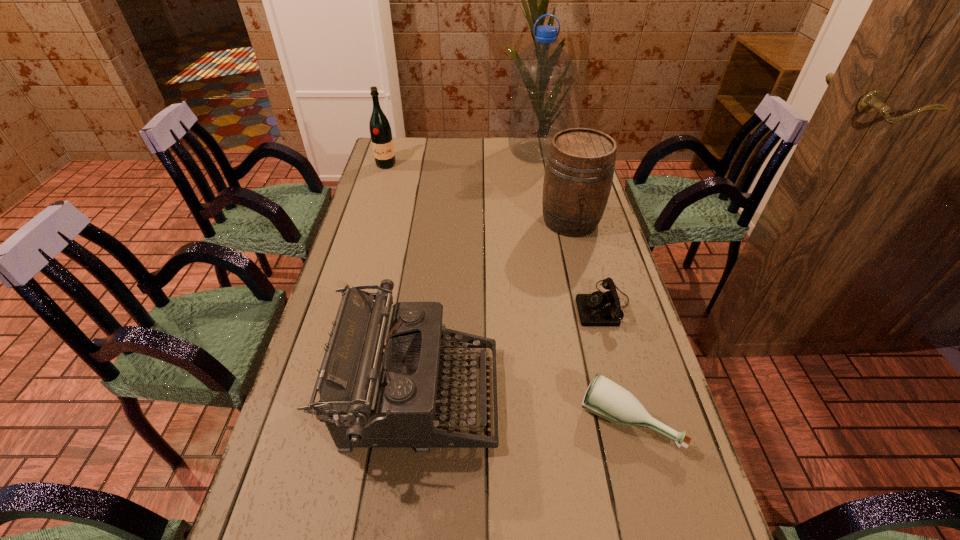
Find the location of a particular element. free spot between the water jug and the bottle is located at coordinates 581,286.

Where is `empty location between the second object from left to right and the bottle`? This screenshot has height=540, width=960. empty location between the second object from left to right and the bottle is located at coordinates (522, 408).

Identify the location of empty space that is in between the bottle and the fifth object from right to left. (522, 408).

Identify the location of free space between the water jug and the liquor. This screenshot has height=540, width=960. (461, 159).

Where is `free point between the bottle and the fifth object from right to left`? The height and width of the screenshot is (540, 960). free point between the bottle and the fifth object from right to left is located at coordinates (522, 408).

This screenshot has width=960, height=540. What are the coordinates of `vacant space that's between the telephone and the bottle` in the screenshot? It's located at (615, 362).

The width and height of the screenshot is (960, 540). I want to click on object that stands as the closest to the liquor, so click(542, 75).

The image size is (960, 540). Identify the location of the second closest object to the telephone. (580, 166).

Image resolution: width=960 pixels, height=540 pixels. Identify the location of vacant area in the image that satisfies the following two spatial constraints: 1. on the side of the fourth nearest object near the bung hole; 2. on the typing side of the third shortest object. (613, 396).

At what (x,y) coordinates should I click in order to perform the action: click on free point that satisfies the following two spatial constraints: 1. on the back side of the bottle; 2. on the typing side of the second object from left to right. Please return your answer as a coordinate pair (x, y). Looking at the image, I should click on (621, 396).